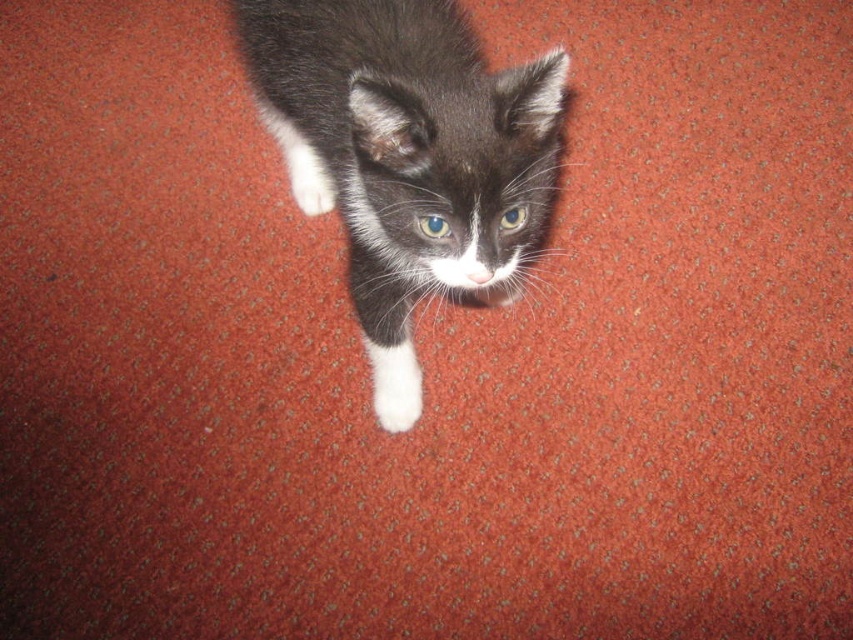
Is black and white fur kitten at center taller than white fluffy paw at center?

Yes, black and white fur kitten at center is taller than white fluffy paw at center.

Does point (393, 128) lie behind point (407, 403)?

That is False.

Which is behind, point (497, 250) or point (380, 364)?

The point (380, 364) is behind.

Where is `black and white fur kitten at center`? The width and height of the screenshot is (853, 640). black and white fur kitten at center is located at coordinates (407, 145).